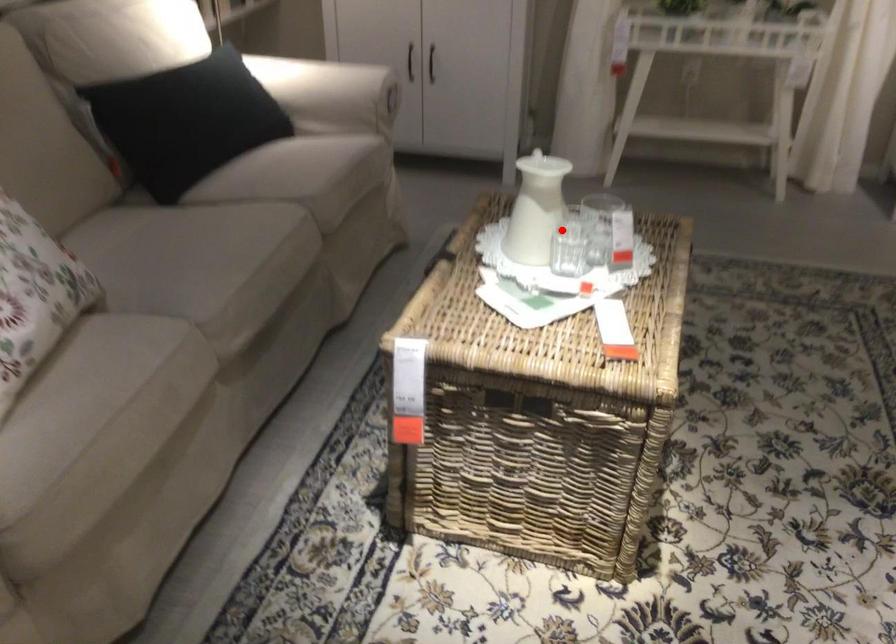
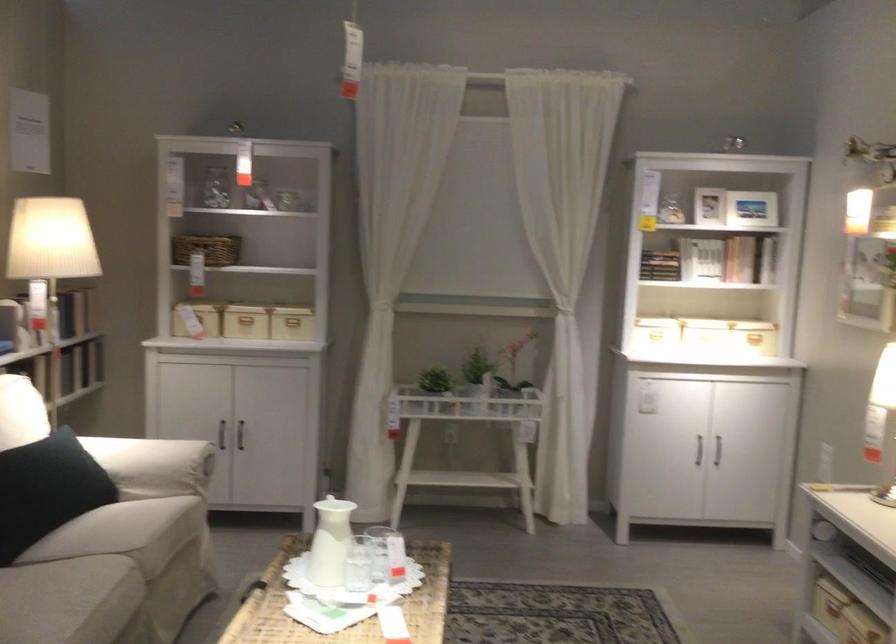
Locate, in the second image, the point that corresponds to the highlighted location in the first image.

(358, 564)